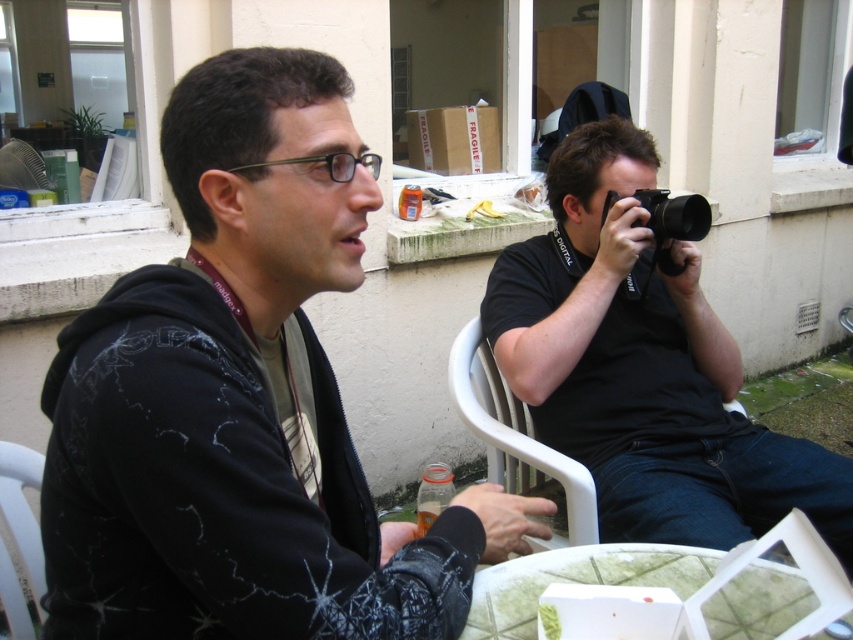
Question: Is black matte hoodie at center positioned before black matte camera at center?

Choices:
 (A) no
 (B) yes

Answer: (B)

Question: Estimate the real-world distances between objects in this image. Which object is farther from the black matte hoodie at center?

Choices:
 (A) white plastic chair at lower left
 (B) black plastic camera at center

Answer: (B)

Question: Among these points, which one is farthest from the camera?

Choices:
 (A) (21, 468)
 (B) (611, 582)
 (C) (373, 156)

Answer: (A)

Question: Is black matte hoodie at center behind black plastic camera at center?

Choices:
 (A) no
 (B) yes

Answer: (A)

Question: Where is black matte hoodie at center located in relation to white glass table at lower center in the image?

Choices:
 (A) above
 (B) below

Answer: (A)

Question: Among these points, which one is farthest from the camera?

Choices:
 (A) (630, 257)
 (B) (38, 608)
 (C) (300, 564)
 (D) (491, 404)

Answer: (D)